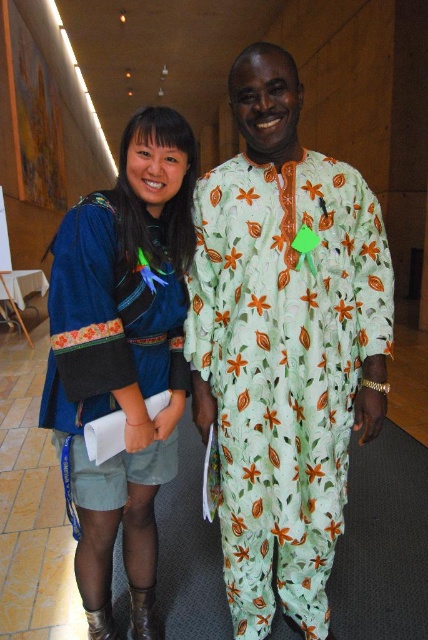
Does green floral fabric at center have a lesser width compared to velvet blue dress at center?

No.

Who is positioned more to the right, green floral fabric at center or velvet blue dress at center?

From the viewer's perspective, green floral fabric at center appears more on the right side.

Which is in front, point (386, 308) or point (136, 532)?

Positioned in front is point (386, 308).

Locate an element on the screen. This screenshot has width=428, height=640. green floral fabric at center is located at coordinates (284, 368).